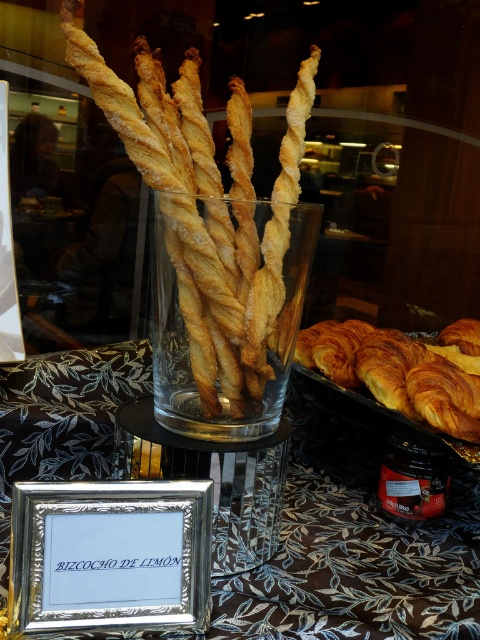
Where is `golden-brown crispy pastry at center`? The image size is (480, 640). golden-brown crispy pastry at center is located at coordinates (206, 208).

Locate an element on the screen. golden-brown crispy pastry at center is located at coordinates (206, 208).

Who is more distant from viewer, [451,557] or [429,362]?

The point [429,362] is behind.

Can you confirm if black fabric tablecloth at center is shorter than golden brown flaky croissant at lower right?

Incorrect, black fabric tablecloth at center's height does not fall short of golden brown flaky croissant at lower right's.

At what (x,y) coordinates should I click in order to perform the action: click on black fabric tablecloth at center. Please return your answer as a coordinate pair (x, y). This screenshot has height=640, width=480. Looking at the image, I should click on (356, 570).

Can you confirm if silver metallic frame at lower center is positioned above golden brown flaky croissant at lower right?

No.

Is silver metallic frame at lower center positioned at the back of golden brown flaky croissant at lower right?

No, it is in front of golden brown flaky croissant at lower right.

Is point (169, 616) positioned in front of point (372, 333)?

Yes, it is in front of point (372, 333).

Locate an element on the screen. Image resolution: width=480 pixels, height=640 pixels. silver metallic frame at lower center is located at coordinates (110, 554).